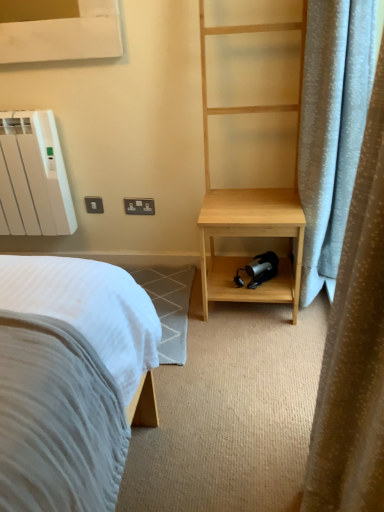
Question: Considering the positions of point (41, 176) and point (331, 425), is point (41, 176) closer or farther from the camera than point (331, 425)?

Choices:
 (A) farther
 (B) closer

Answer: (A)

Question: In terms of width, does white matte radiator at upper left look wider or thinner when compared to light blue fabric curtain at right?

Choices:
 (A) wide
 (B) thin

Answer: (B)

Question: Based on their relative distances, which object is nearer to the light blue fabric curtain at right?

Choices:
 (A) natural wood bookshelf at right
 (B) white plastic electric outlet at upper center
 (C) white matte radiator at upper left

Answer: (A)

Question: Estimate the real-world distances between objects in this image. Which object is closer to the natural wood bookshelf at right?

Choices:
 (A) white plastic electric outlet at upper center
 (B) light blue fabric curtain at right
 (C) white matte radiator at upper left

Answer: (A)